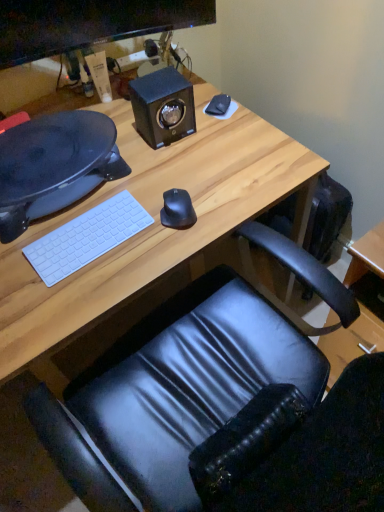
Question: Is black matte mouse at center outside matte black monitor at upper left?

Choices:
 (A) no
 (B) yes

Answer: (B)

Question: Can you confirm if black matte mouse at center is shorter than matte black monitor at upper left?

Choices:
 (A) no
 (B) yes

Answer: (B)

Question: Are black matte mouse at center and matte black monitor at upper left far apart?

Choices:
 (A) yes
 (B) no

Answer: (B)

Question: Can you confirm if black matte mouse at center is wider than matte black monitor at upper left?

Choices:
 (A) yes
 (B) no

Answer: (A)

Question: Is black matte mouse at center aimed at matte black monitor at upper left?

Choices:
 (A) no
 (B) yes

Answer: (A)

Question: From their relative heights in the image, would you say black glossy speaker at left is taller or shorter than white matte keyboard at lower left?

Choices:
 (A) short
 (B) tall

Answer: (B)

Question: In terms of size, does black glossy speaker at left appear bigger or smaller than white matte keyboard at lower left?

Choices:
 (A) big
 (B) small

Answer: (A)

Question: Is black glossy speaker at left to the left or to the right of white matte keyboard at lower left in the image?

Choices:
 (A) right
 (B) left

Answer: (B)

Question: Is black glossy speaker at left spatially inside white matte keyboard at lower left, or outside of it?

Choices:
 (A) outside
 (B) inside

Answer: (A)

Question: Considering the positions of point (160, 128) and point (190, 11), is point (160, 128) closer or farther from the camera than point (190, 11)?

Choices:
 (A) closer
 (B) farther

Answer: (A)

Question: From a real-world perspective, is black textured speaker at upper center positioned above or below matte black monitor at upper left?

Choices:
 (A) above
 (B) below

Answer: (B)

Question: In terms of height, does black textured speaker at upper center look taller or shorter compared to matte black monitor at upper left?

Choices:
 (A) tall
 (B) short

Answer: (B)

Question: Is black textured speaker at upper center situated inside matte black monitor at upper left or outside?

Choices:
 (A) outside
 (B) inside

Answer: (A)

Question: From a real-world perspective, is matte black monitor at upper left above or below black textured speaker at upper center?

Choices:
 (A) above
 (B) below

Answer: (A)

Question: Is matte black monitor at upper left inside or outside of black textured speaker at upper center?

Choices:
 (A) inside
 (B) outside

Answer: (B)